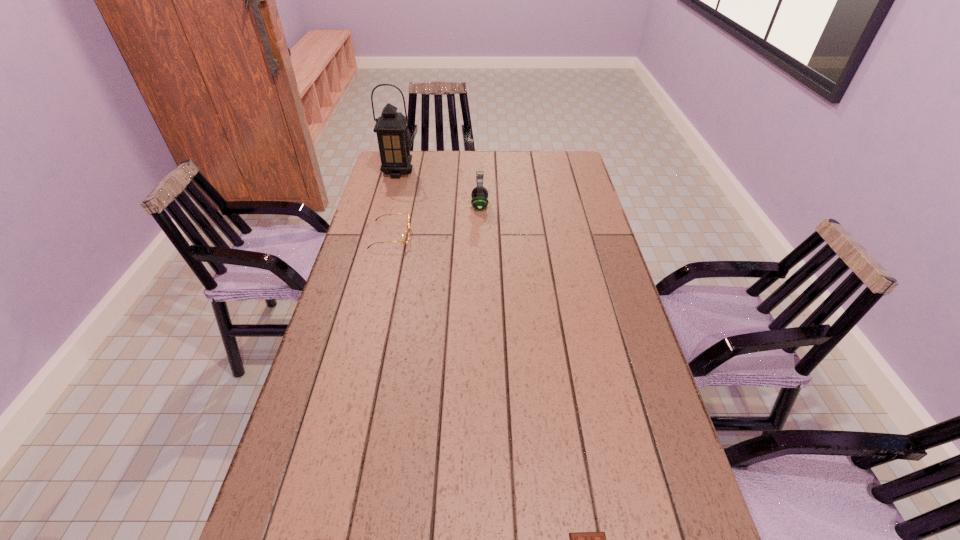
Where is `the tallest object`? the tallest object is located at coordinates pyautogui.click(x=391, y=128).

The width and height of the screenshot is (960, 540). What are the coordinates of `lantern` in the screenshot? It's located at (391, 128).

What are the coordinates of `the third object from left to right` in the screenshot? It's located at (479, 194).

Find the location of a particular element. This screenshot has width=960, height=540. headset is located at coordinates (479, 194).

Where is `the third farthest object`? This screenshot has width=960, height=540. the third farthest object is located at coordinates (405, 236).

Image resolution: width=960 pixels, height=540 pixels. What are the coordinates of `spectacles` in the screenshot? It's located at (405, 236).

Identify the location of vacant area located 0.280m on the right of the tallest object. This screenshot has height=540, width=960. (481, 172).

You are a GUI agent. You are given a task and a screenshot of the screen. Output one action in this format:
    pyautogui.click(x=<x>, y=<y>)
    Task: Click on the vacant space located 0.350m on the ear cups of the third object from left to right
    The width and height of the screenshot is (960, 540).
    Given the screenshot: What is the action you would take?
    pyautogui.click(x=583, y=206)

This screenshot has height=540, width=960. Identify the location of free location located 0.170m on the front-facing side of the second nearest object. pos(460,235).

I want to click on object at the far edge, so click(x=391, y=128).